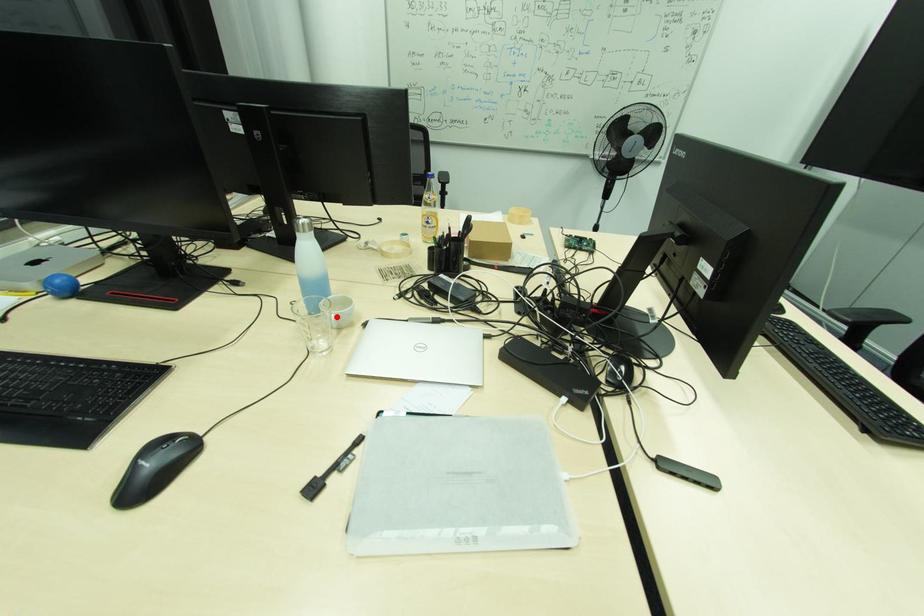
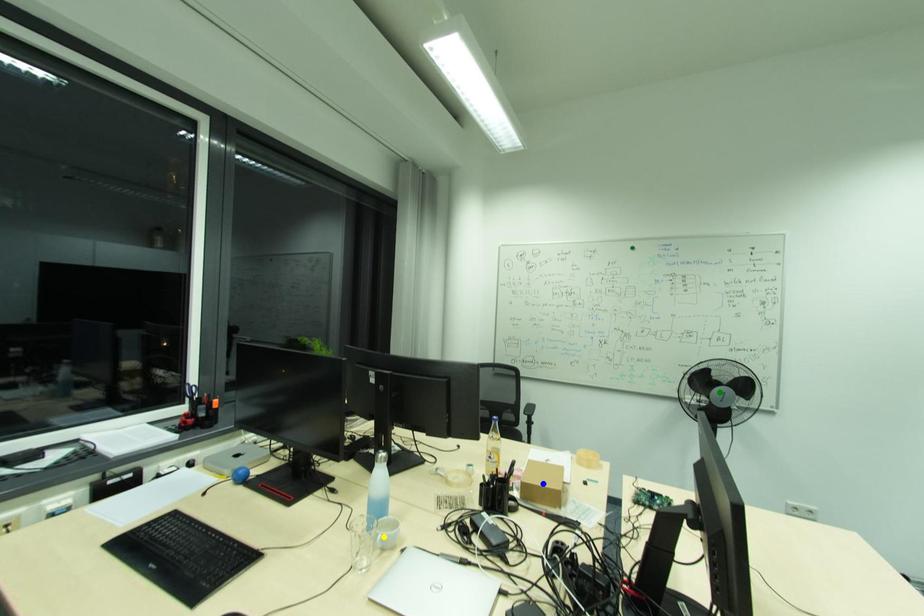
Question: I am providing you with two images of the same scene from different viewpoints. A red point is marked on the first image. You are given multiple points on the second image. Which mark in image 2 goes with the point in image 1?

Choices:
 (A) blue point
 (B) yellow point
 (C) green point

Answer: (B)